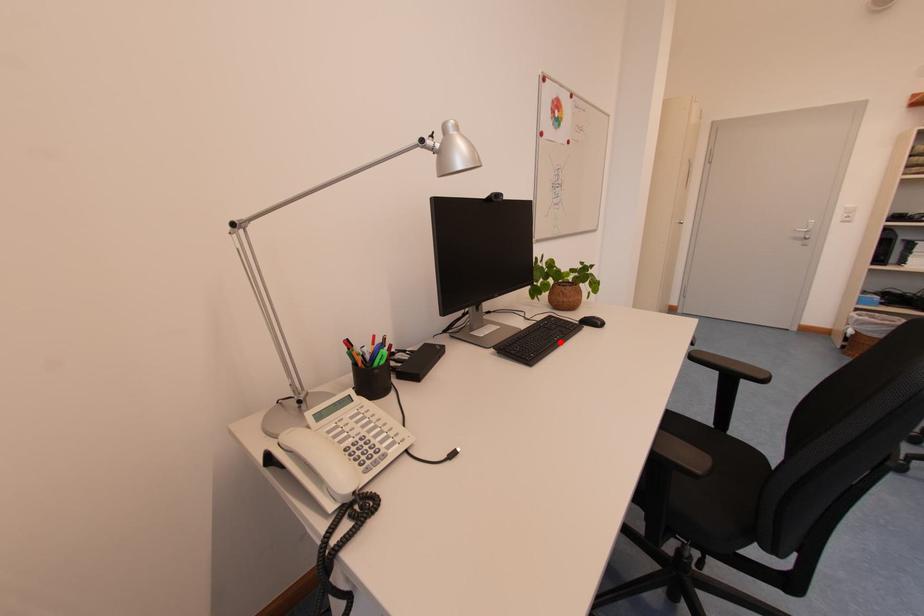
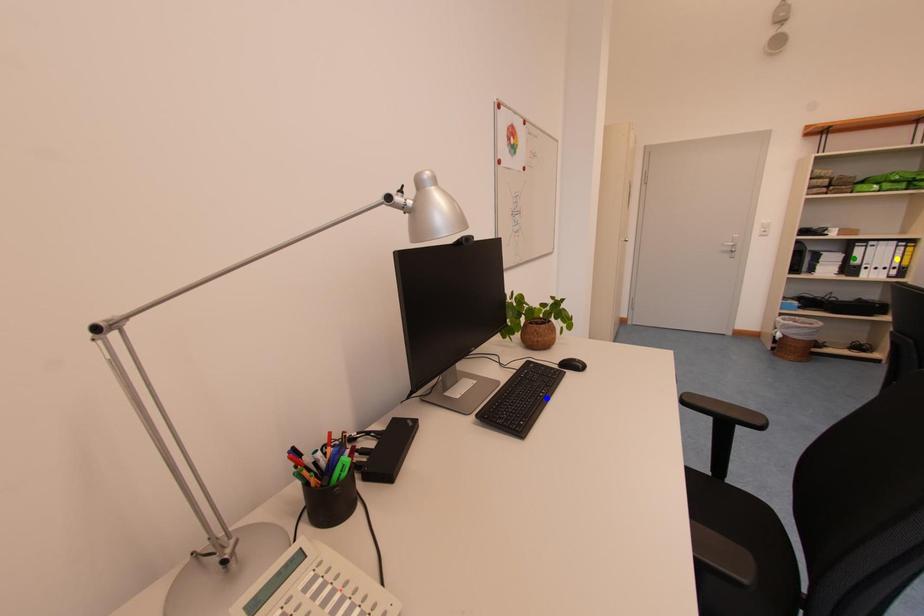
Question: I am providing you with two images of the same scene from different viewpoints. A red point is marked on the first image. You are given multiple points on the second image. Which spot in image 2 lines up with the point in image 1?

Choices:
 (A) yellow point
 (B) green point
 (C) blue point

Answer: (C)